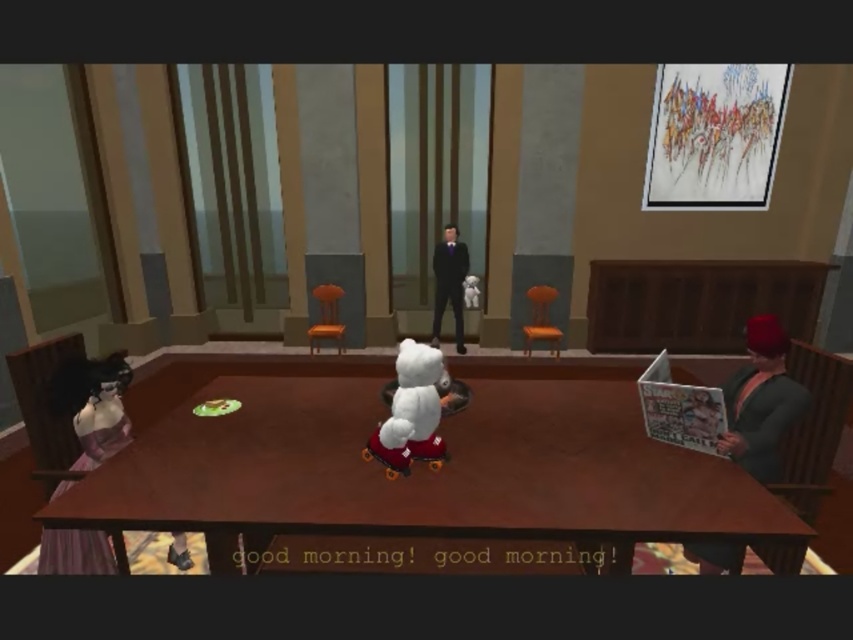
Based on the photo, is brown wooden table at center closer to camera compared to matte purple dress at lower left?

Yes.

This screenshot has height=640, width=853. What do you see at coordinates (427, 474) in the screenshot? I see `brown wooden table at center` at bounding box center [427, 474].

Find the location of `brown wooden table at center`. brown wooden table at center is located at coordinates (427, 474).

The width and height of the screenshot is (853, 640). What do you see at coordinates (450, 284) in the screenshot?
I see `shiny black suit at center` at bounding box center [450, 284].

Who is more distant from viewer, (436, 246) or (538, 296)?

The point (436, 246) is behind.

At what (x,y) coordinates should I click in order to perform the action: click on shiny black suit at center. Please return your answer as a coordinate pair (x, y). Looking at the image, I should click on (450, 284).

Does point (782, 419) lie behind point (548, 339)?

No, it is not.

Locate an element on the screen. This screenshot has width=853, height=640. green fabric cap at right is located at coordinates (761, 401).